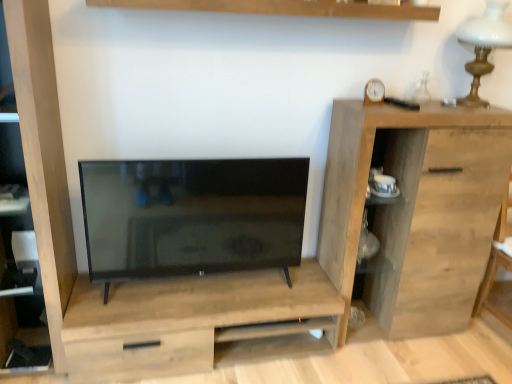
The image size is (512, 384). In order to click on vacant space to the left of wooden clock at upper right in this screenshot , I will do 348,102.